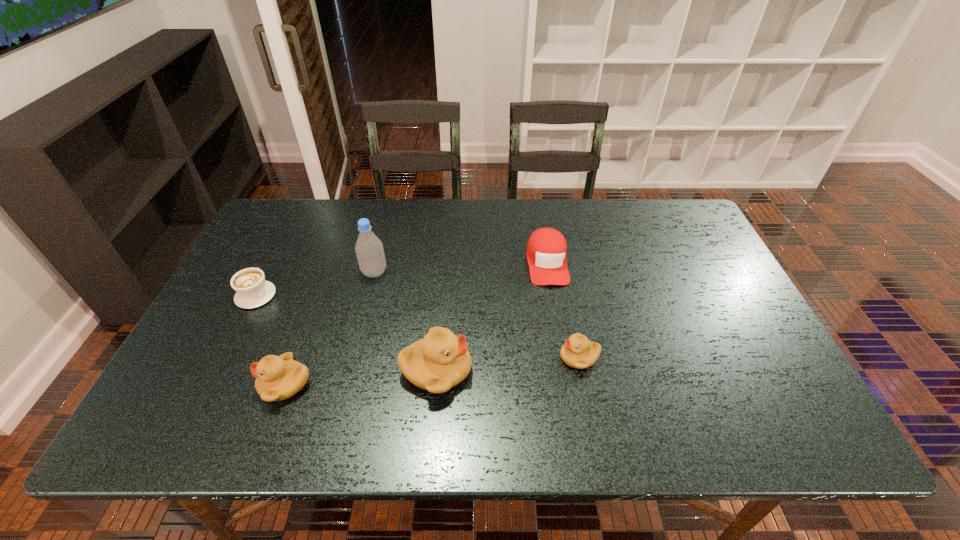
The ducklings are evenly distributed in the image. To maintain this, where would you place another duckling on the right? Please point to a free space. Please provide its 2D coordinates. Your answer should be formatted as a tuple, i.e. [(x, y)], where the tuple contains the x and y coordinates of a point satisfying the conditions above.

[(715, 345)]